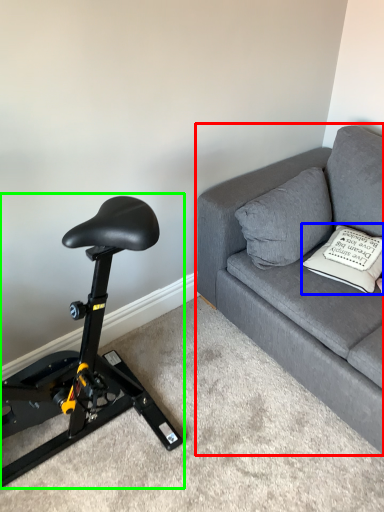
Question: Estimate the real-world distances between objects in this image. Which object is farther from studio couch (highlighted by a red box), pillow (highlighted by a blue box) or stationary bicycle (highlighted by a green box)?

Choices:
 (A) pillow
 (B) stationary bicycle

Answer: (B)